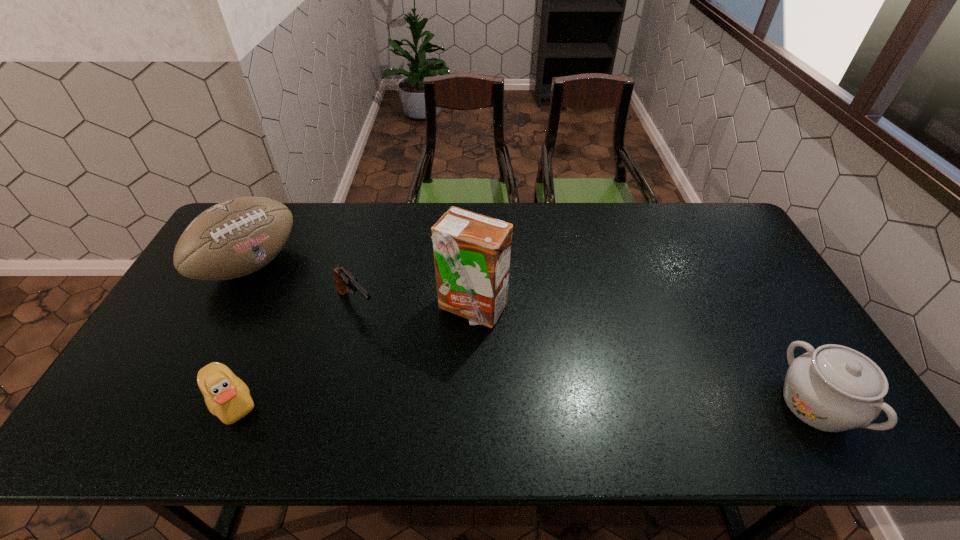
The width and height of the screenshot is (960, 540). I want to click on duck, so click(227, 397).

Where is `chinaware`? Image resolution: width=960 pixels, height=540 pixels. chinaware is located at coordinates pyautogui.click(x=834, y=388).

This screenshot has height=540, width=960. I want to click on the rightmost object, so click(834, 388).

The height and width of the screenshot is (540, 960). What are the coordinates of `gun` in the screenshot? It's located at (343, 278).

I want to click on the fourth object from left to right, so coord(472,252).

The image size is (960, 540). Find the location of `carton`. carton is located at coordinates (472, 252).

Find the location of a particular element. The width and height of the screenshot is (960, 540). the fourth shortest object is located at coordinates (237, 237).

Find the location of a particular element. The height and width of the screenshot is (540, 960). vacant space located on the left of the rightmost object is located at coordinates (754, 404).

The height and width of the screenshot is (540, 960). I want to click on vacant area located along the barrel of the third object from right to left, so click(430, 387).

What are the coordinates of `vacant position located along the barrel of the third object from right to left` in the screenshot? It's located at (445, 403).